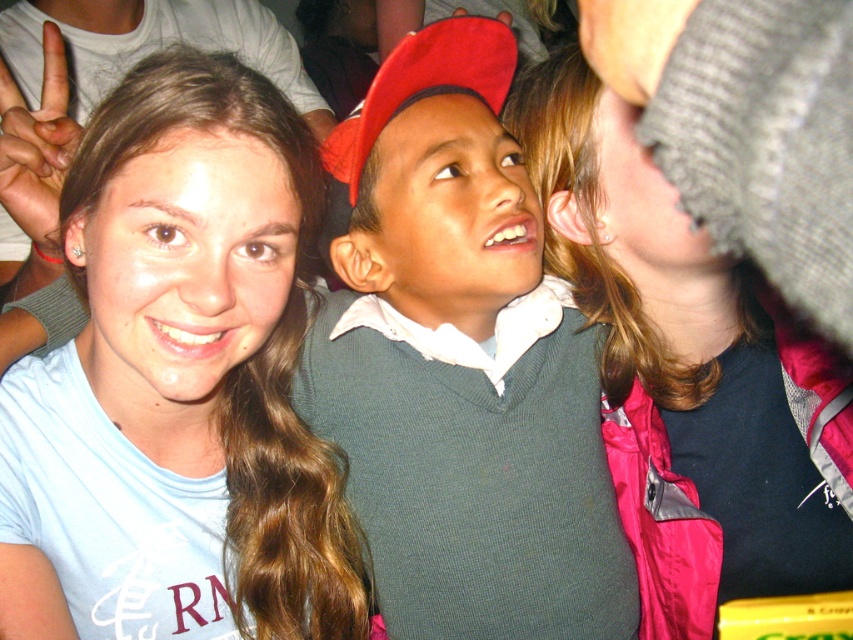
This screenshot has width=853, height=640. What do you see at coordinates (178, 384) in the screenshot? I see `light blue cotton shirt at center` at bounding box center [178, 384].

Consider the image. Is light blue cotton shirt at center thinner than green knitted sweater at center?

Indeed, light blue cotton shirt at center has a lesser width compared to green knitted sweater at center.

Locate an element on the screen. Image resolution: width=853 pixels, height=640 pixels. light blue cotton shirt at center is located at coordinates (178, 384).

Does green knitted sweater at center have a lesser height compared to knitted gray hat at upper right?

Indeed, green knitted sweater at center has a lesser height compared to knitted gray hat at upper right.

Who is positioned more to the left, green knitted sweater at center or knitted gray hat at upper right?

From the viewer's perspective, green knitted sweater at center appears more on the left side.

Between point (444, 384) and point (692, 554), which one is positioned in front?

Point (444, 384) is more forward.

I want to click on green knitted sweater at center, so click(x=460, y=364).

Can you confirm if light blue cotton shirt at center is positioned to the right of knitted gray hat at upper right?

In fact, light blue cotton shirt at center is to the left of knitted gray hat at upper right.

Measure the distance between light blue cotton shirt at center and camera.

light blue cotton shirt at center is 25.04 inches from camera.

Identify the location of light blue cotton shirt at center. (x=178, y=384).